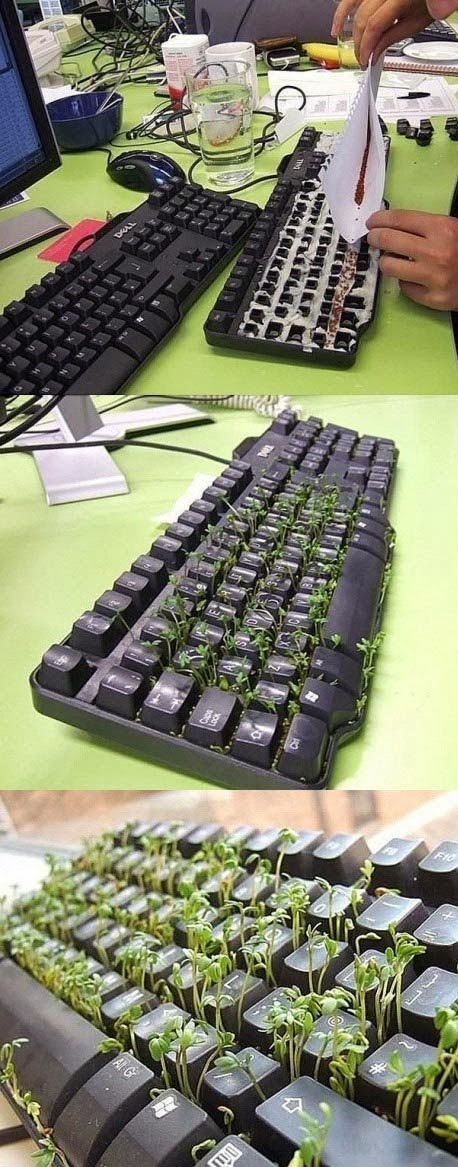
This screenshot has width=458, height=1167. Find the location of `spoon`. spoon is located at coordinates (x=118, y=82).